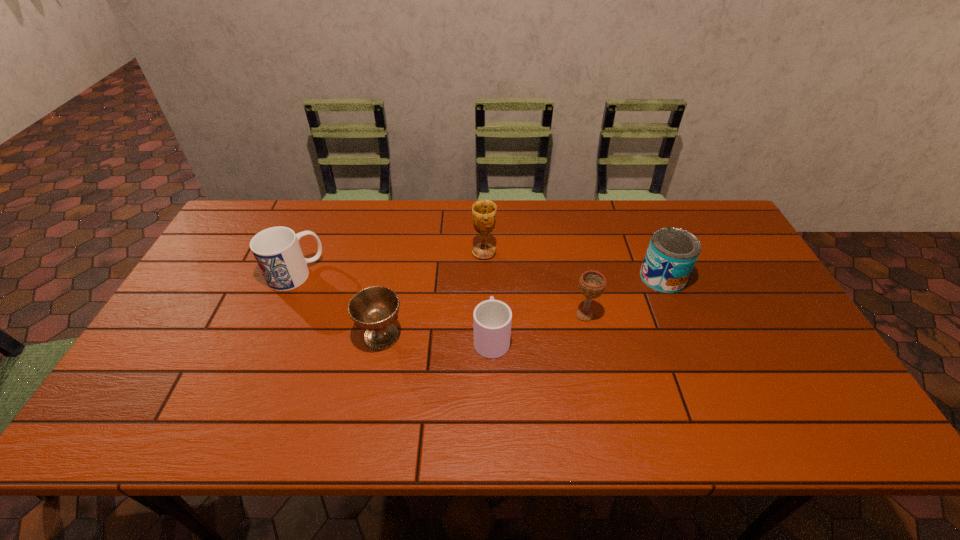
Image resolution: width=960 pixels, height=540 pixels. I want to click on empty space between the second object from left to right and the cup, so click(x=437, y=336).

Identify the location of object that is the fifth closest to the leftmost object. Image resolution: width=960 pixels, height=540 pixels. (672, 253).

The image size is (960, 540). In order to click on the fifth closest object to the rightmost object in this screenshot , I will do `click(277, 251)`.

Identify which chalice is the nearest to the farthest chalice. Please provide its 2D coordinates. Your answer should be formatted as a tuple, i.e. [(x, y)], where the tuple contains the x and y coordinates of a point satisfying the conditions above.

[(592, 283)]

Identify which chalice is the second closest to the second object from left to right. Please provide its 2D coordinates. Your answer should be formatted as a tuple, i.e. [(x, y)], where the tuple contains the x and y coordinates of a point satisfying the conditions above.

[(592, 283)]

The height and width of the screenshot is (540, 960). Find the location of `vacant space that satisfies the following two spatial constraints: 1. with the handle on the side of the rightmost chalice; 2. on the right side of the cup`. vacant space that satisfies the following two spatial constraints: 1. with the handle on the side of the rightmost chalice; 2. on the right side of the cup is located at coordinates (492, 315).

The width and height of the screenshot is (960, 540). What are the coordinates of `blank space that satisfies the following two spatial constraints: 1. with the handle on the side of the fifth object from left to right; 2. on the left side of the cup` in the screenshot? It's located at (492, 315).

Where is `free spot that satisfies the following two spatial constraints: 1. on the back side of the leftmost chalice; 2. on the left side of the can`? The height and width of the screenshot is (540, 960). free spot that satisfies the following two spatial constraints: 1. on the back side of the leftmost chalice; 2. on the left side of the can is located at coordinates (393, 278).

Locate an element on the screen. Image resolution: width=960 pixels, height=540 pixels. vacant space that satisfies the following two spatial constraints: 1. with the handle on the side of the second object from right to left; 2. on the right side of the cup is located at coordinates (492, 315).